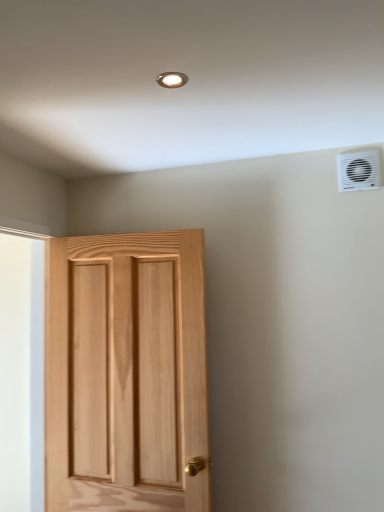
Question: In terms of size, does white plastic air conditioning unit at upper right appear bigger or smaller than matte silver light fixture at upper center?

Choices:
 (A) big
 (B) small

Answer: (A)

Question: In terms of height, does white plastic air conditioning unit at upper right look taller or shorter compared to matte silver light fixture at upper center?

Choices:
 (A) tall
 (B) short

Answer: (A)

Question: Which of these objects is positioned closest to the white plastic air conditioning unit at upper right?

Choices:
 (A) matte silver light fixture at upper center
 (B) natural wood door at left

Answer: (A)

Question: Estimate the real-world distances between objects in this image. Which object is closer to the matte silver light fixture at upper center?

Choices:
 (A) white plastic air conditioning unit at upper right
 (B) natural wood door at left

Answer: (A)